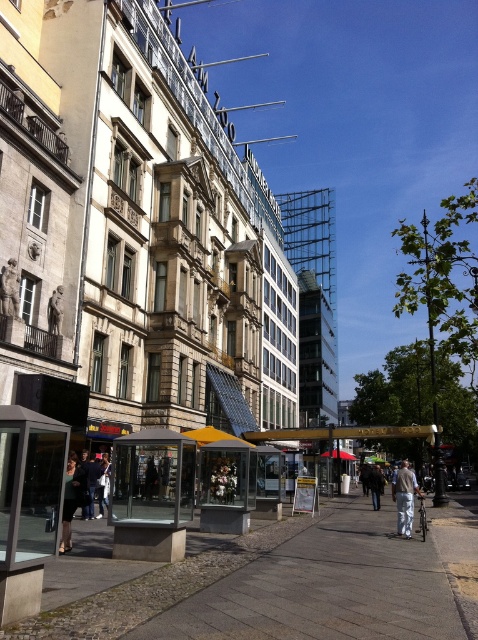
You are a delivery person who needs to place a package on the transparent glass bus stop at center. However, there is a dark gray fabric coat at lower left nearby. Can you place the package on the bus stop without the coat blocking it?

The transparent glass bus stop at center is taller than the dark gray fabric coat at lower left, so the coat is shorter and less likely to block the bus stop. Therefore, you can place the package on the bus stop without the coat blocking it.

You are a delivery person who needs to place a large package on the walkway. The package is as big as the dark gray fabric coat at lower left. Is there enough space between the transparent glass bus stop at center and the curb to place it?

The transparent glass bus stop at center is smaller than the dark gray fabric coat at lower left. Since the package is as big as the dark gray fabric coat at lower left, there might not be enough space between the transparent glass bus stop at center and the curb to place it safely.